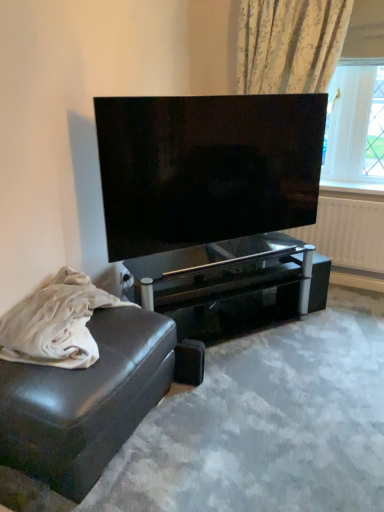
Question: Does black glass table at center turn towards leather couch at lower left?

Choices:
 (A) no
 (B) yes

Answer: (A)

Question: Can leather couch at lower left be found inside black glass table at center?

Choices:
 (A) no
 (B) yes

Answer: (A)

Question: Can you confirm if black glass table at center is bigger than leather couch at lower left?

Choices:
 (A) yes
 (B) no

Answer: (A)

Question: Is black glass table at center taller than leather couch at lower left?

Choices:
 (A) no
 (B) yes

Answer: (B)

Question: Does black glass table at center have a smaller size compared to leather couch at lower left?

Choices:
 (A) yes
 (B) no

Answer: (B)

Question: Based on their positions, is leather couch at lower left located to the left or right of leather couch at lower left?

Choices:
 (A) left
 (B) right

Answer: (B)

Question: Considering the positions of point (3, 338) and point (59, 401), is point (3, 338) closer or farther from the camera than point (59, 401)?

Choices:
 (A) closer
 (B) farther

Answer: (B)

Question: From the image's perspective, is leather couch at lower left positioned above or below leather couch at lower left?

Choices:
 (A) above
 (B) below

Answer: (A)

Question: In terms of width, does leather couch at lower left look wider or thinner when compared to leather couch at lower left?

Choices:
 (A) wide
 (B) thin

Answer: (B)

Question: Is point (352, 219) positioned closer to the camera than point (107, 390)?

Choices:
 (A) farther
 (B) closer

Answer: (A)

Question: In terms of size, does white glossy radiator at upper right appear bigger or smaller than leather couch at lower left?

Choices:
 (A) small
 (B) big

Answer: (A)

Question: Considering their positions, is white glossy radiator at upper right located in front of or behind leather couch at lower left?

Choices:
 (A) behind
 (B) front

Answer: (A)

Question: Is white glossy radiator at upper right wider or thinner than leather couch at lower left?

Choices:
 (A) thin
 (B) wide

Answer: (A)

Question: Relative to matte black tv at center, is leather couch at lower left in front or behind?

Choices:
 (A) behind
 (B) front

Answer: (B)

Question: From the image's perspective, is leather couch at lower left located above or below matte black tv at center?

Choices:
 (A) below
 (B) above

Answer: (A)